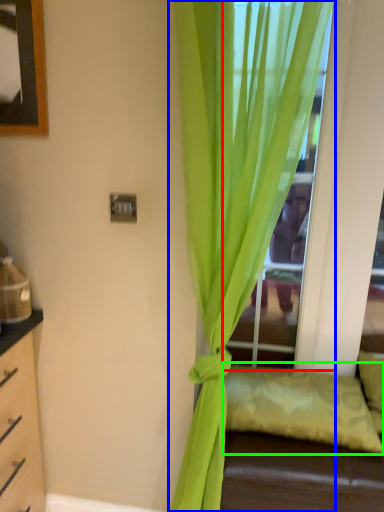
Question: Which object is the farthest from glass door (highlighted by a red box)? Choose among these: curtain (highlighted by a blue box) or pillow (highlighted by a green box).

Choices:
 (A) curtain
 (B) pillow

Answer: (B)